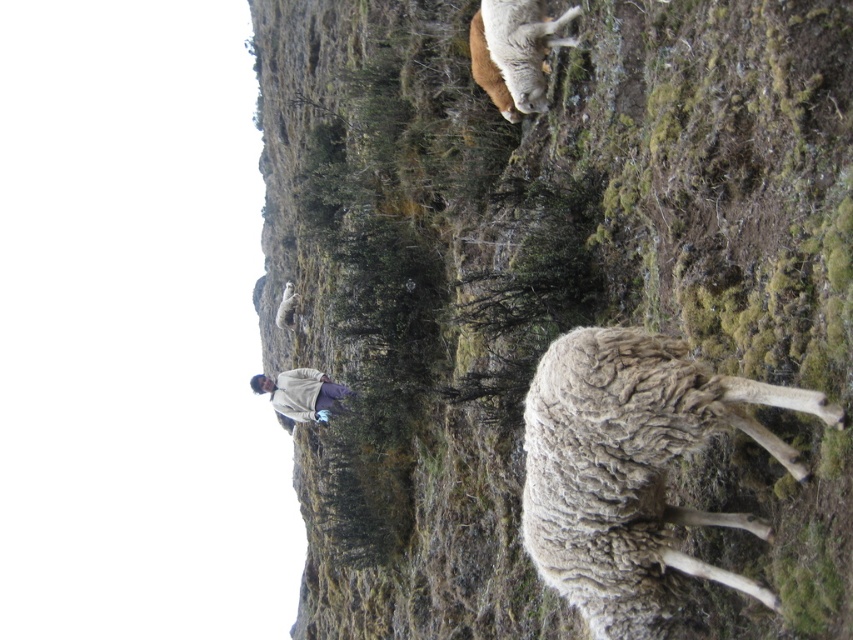
You are a photographer trying to capture a shot of both the white woolly sheep at upper center and the light gray woolen sweater at center. Based on their positions, which object should you adjust your camera angle to focus on first if you want to include both in the frame?

The white woolly sheep at upper center is to the right of the light gray woolen sweater at center. To include both in the frame, you should first focus on the white woolly sheep at upper center since it is positioned further to the right, ensuring there is enough space to capture both objects in the shot.

You are a photographer trying to capture the sheep in the scene. The fuzzy wool sheep at center and the light gray woolen sweater at center are both in your viewfinder. According to the scene, which object is positioned higher in the frame?

The fuzzy wool sheep at center is located above the light gray woolen sweater at center, so the fuzzy wool sheep at center is positioned higher in the frame.

You are standing at the camera position and want to take a photo of the fuzzy wool sheep at center. What are the coordinates where you should point your camera to capture it?

The fuzzy wool sheep at center is located at coordinates point (527,262), so you should point your camera there to capture it.